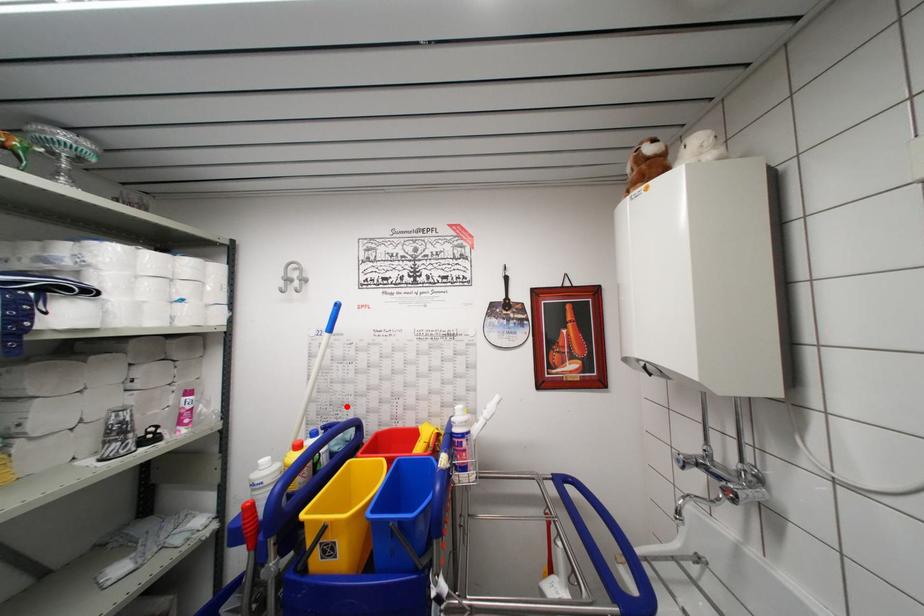
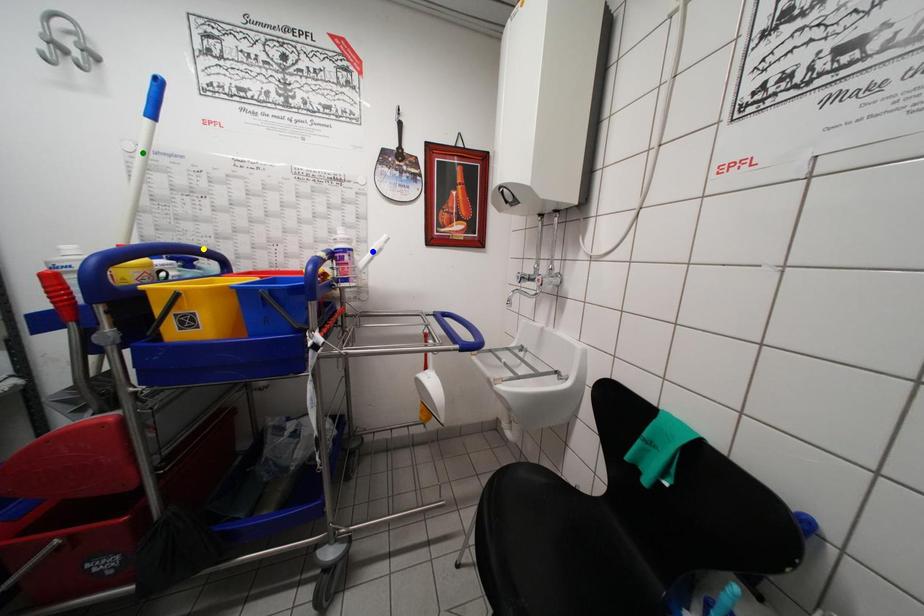
Question: I am providing you with two images of the same scene from different viewpoints. A red point is marked on the first image. You are given multiple points on the second image. Which mark in image 2 goes with the point in image 1?

Choices:
 (A) yellow point
 (B) green point
 (C) blue point

Answer: (A)